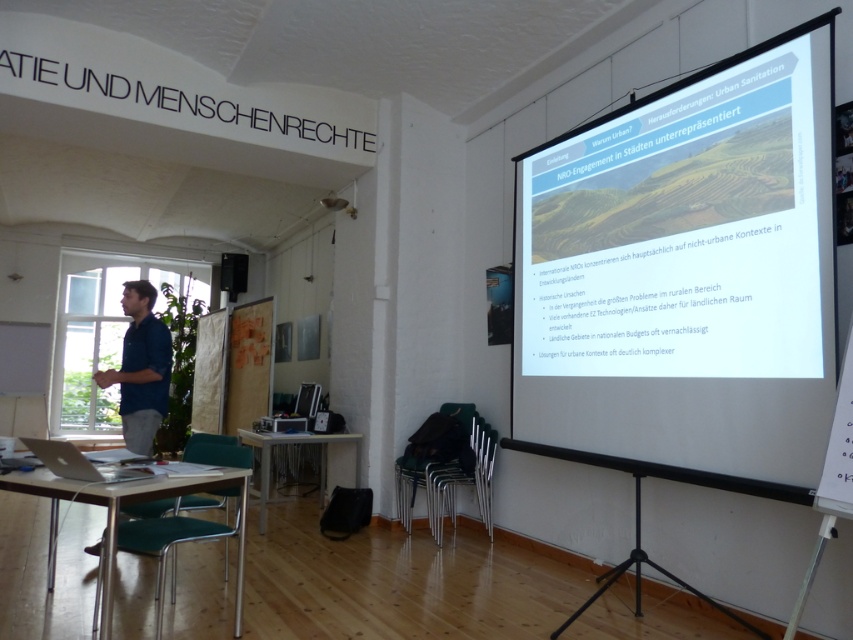
Question: Which object is positioned farthest from the wooden table at center?

Choices:
 (A) silver metallic laptop at lower left
 (B) metallic silver table at lower left
 (C) blue shirt at left

Answer: (A)

Question: Among these objects, which one is farthest from the camera?

Choices:
 (A) metallic silver table at lower left
 (B) blue shirt at left

Answer: (B)

Question: Which object is positioned closest to the white matte projection screen at upper right?

Choices:
 (A) blue shirt at left
 (B) silver metallic laptop at lower left
 (C) metallic silver table at lower left

Answer: (C)

Question: Can you confirm if wooden table at center is thinner than silver metallic laptop at lower left?

Choices:
 (A) no
 (B) yes

Answer: (A)

Question: Can you confirm if white matte projection screen at upper right is positioned above metallic silver table at lower left?

Choices:
 (A) yes
 (B) no

Answer: (A)

Question: Is white matte projection screen at upper right further to the viewer compared to blue shirt at left?

Choices:
 (A) yes
 (B) no

Answer: (B)